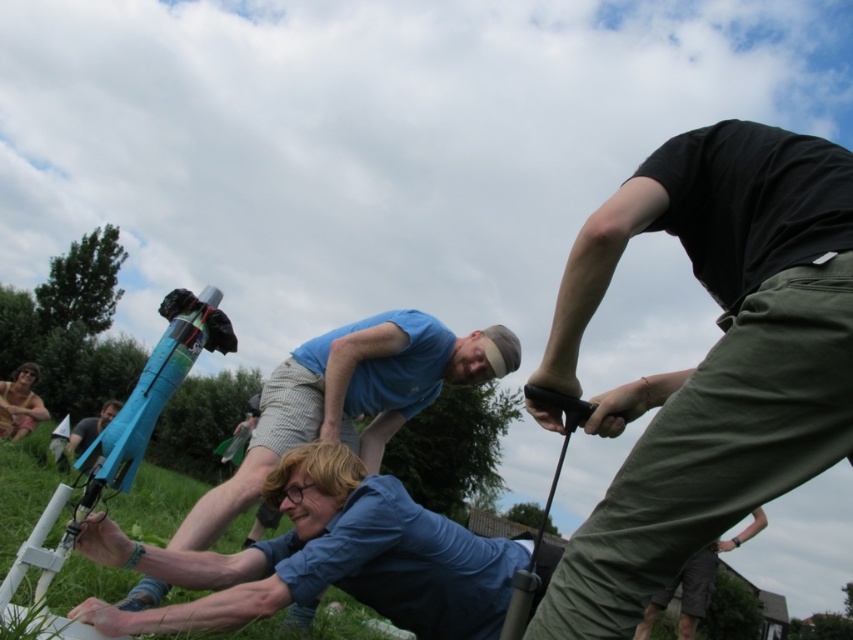
Question: Does green grass at lower left appear on the right side of brown textured fabric at lower left?

Choices:
 (A) yes
 (B) no

Answer: (A)

Question: Estimate the real-world distances between objects in this image. Which object is farther from the brown textured fabric at lower left?

Choices:
 (A) black cotton shirt at upper right
 (B) matte blue rocket at left

Answer: (A)

Question: Which point is closer to the camera?

Choices:
 (A) (24, 605)
 (B) (541, 634)

Answer: (B)

Question: Is blue cotton shirt at center thinner than green grass at lower left?

Choices:
 (A) no
 (B) yes

Answer: (A)

Question: Can you confirm if brown textured fabric at lower left is bigger than matte blue rocket at left?

Choices:
 (A) yes
 (B) no

Answer: (B)

Question: Which point appears farthest from the camera in this image?

Choices:
 (A) (113, 401)
 (B) (502, 353)
 (C) (47, 612)

Answer: (A)